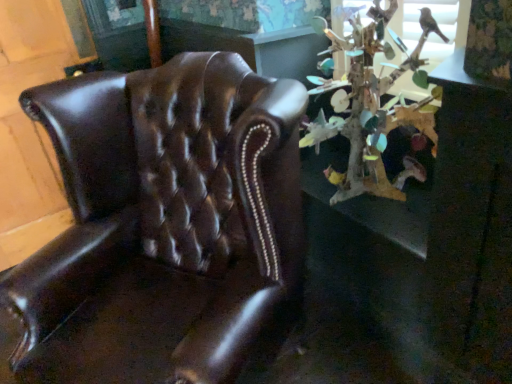
What do you see at coordinates (162, 223) in the screenshot?
I see `brown leather chair at left` at bounding box center [162, 223].

Looking at this image, in order to face brown leather chair at left, should I rotate leftwards or rightwards?

Rotate your view left by about 12.911°.

What are the coordinates of `brown leather chair at left` in the screenshot? It's located at (162, 223).

This screenshot has height=384, width=512. I want to click on brown leather chair at left, so 162,223.